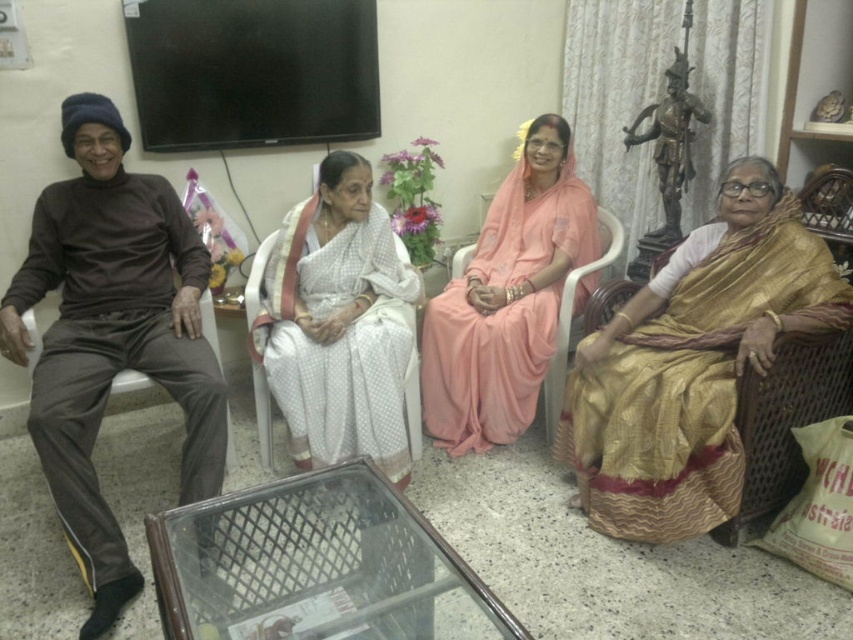
Does pink silk saree at center have a lesser height compared to brown fabric armchair at left?

In fact, pink silk saree at center may be taller than brown fabric armchair at left.

Which is in front, point (540, 145) or point (230, 470)?

Point (230, 470) is more forward.

Who is more forward, (556, 186) or (30, 349)?

Positioned in front is point (30, 349).

Identify the location of pink silk saree at center. (508, 298).

Does gold silk saree at right appear over brown fabric armchair at left?

Indeed, gold silk saree at right is positioned over brown fabric armchair at left.

Which is below, gold silk saree at right or brown fabric armchair at left?

brown fabric armchair at left is lower down.

Is point (689, 381) behind point (140, 380)?

No, (689, 381) is closer to viewer.

Locate an element on the screen. gold silk saree at right is located at coordinates (693, 364).

Does gold silk saree at right have a greater width compared to white silk saree at center?

Yes, gold silk saree at right is wider than white silk saree at center.

Is gold silk saree at right taller than white silk saree at center?

Yes.

Is point (804, 252) farther from viewer compared to point (335, 429)?

No, it is in front of (335, 429).

What are the coordinates of `gold silk saree at right` in the screenshot? It's located at (693, 364).